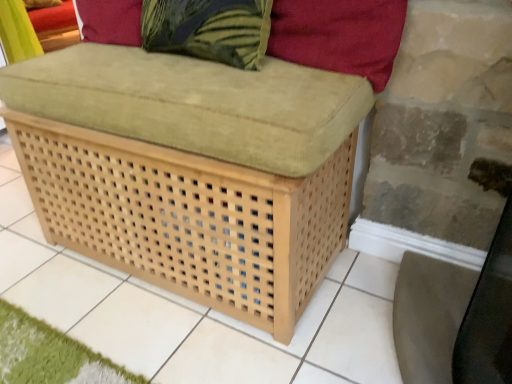
Question: From a real-world perspective, is velvet red pillow at upper right under light brown woven ottoman at center?

Choices:
 (A) no
 (B) yes

Answer: (A)

Question: Is velvet red pillow at upper right closer to camera compared to light brown woven ottoman at center?

Choices:
 (A) no
 (B) yes

Answer: (A)

Question: Is light brown woven ottoman at center located within velvet red pillow at upper right?

Choices:
 (A) no
 (B) yes

Answer: (A)

Question: From the image's perspective, is velvet red pillow at upper right under light brown woven ottoman at center?

Choices:
 (A) no
 (B) yes

Answer: (A)

Question: Does velvet red pillow at upper right have a greater height compared to light brown woven ottoman at center?

Choices:
 (A) yes
 (B) no

Answer: (B)

Question: Is velvet red pillow at upper right wider than light brown woven ottoman at center?

Choices:
 (A) no
 (B) yes

Answer: (A)

Question: Considering the relative sizes of matte beige swivel chair at lower right and velvet red pillow at upper right in the image provided, is matte beige swivel chair at lower right wider than velvet red pillow at upper right?

Choices:
 (A) yes
 (B) no

Answer: (A)

Question: From a real-world perspective, is matte beige swivel chair at lower right positioned over velvet red pillow at upper right based on gravity?

Choices:
 (A) yes
 (B) no

Answer: (B)

Question: Is matte beige swivel chair at lower right to the right of velvet red pillow at upper right from the viewer's perspective?

Choices:
 (A) no
 (B) yes

Answer: (B)

Question: Is matte beige swivel chair at lower right smaller than velvet red pillow at upper right?

Choices:
 (A) yes
 (B) no

Answer: (B)

Question: Is matte beige swivel chair at lower right bigger than velvet red pillow at upper right?

Choices:
 (A) no
 (B) yes

Answer: (B)

Question: Could you tell me if matte beige swivel chair at lower right is facing velvet red pillow at upper right?

Choices:
 (A) no
 (B) yes

Answer: (A)

Question: Does green textured pillow at upper center contain matte beige swivel chair at lower right?

Choices:
 (A) yes
 (B) no

Answer: (B)